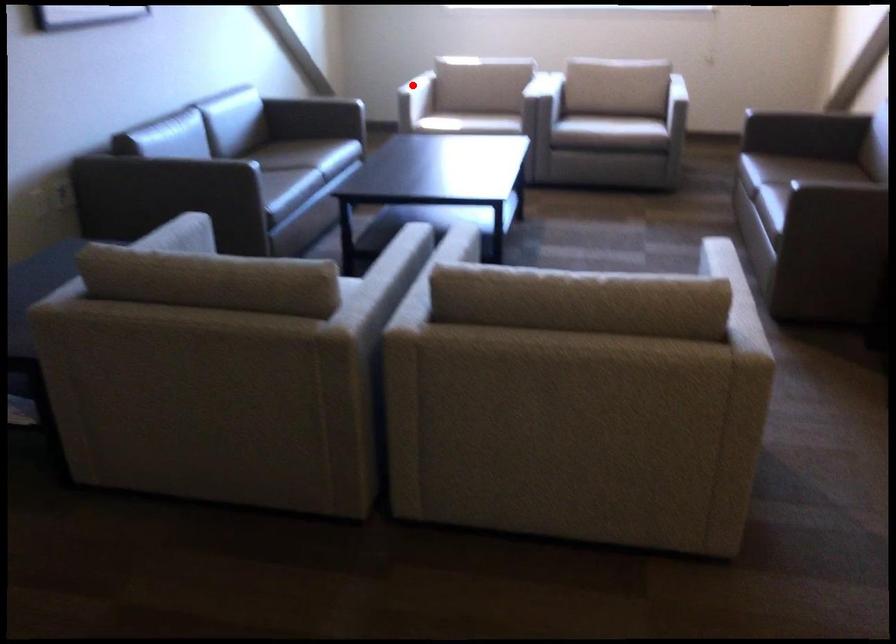
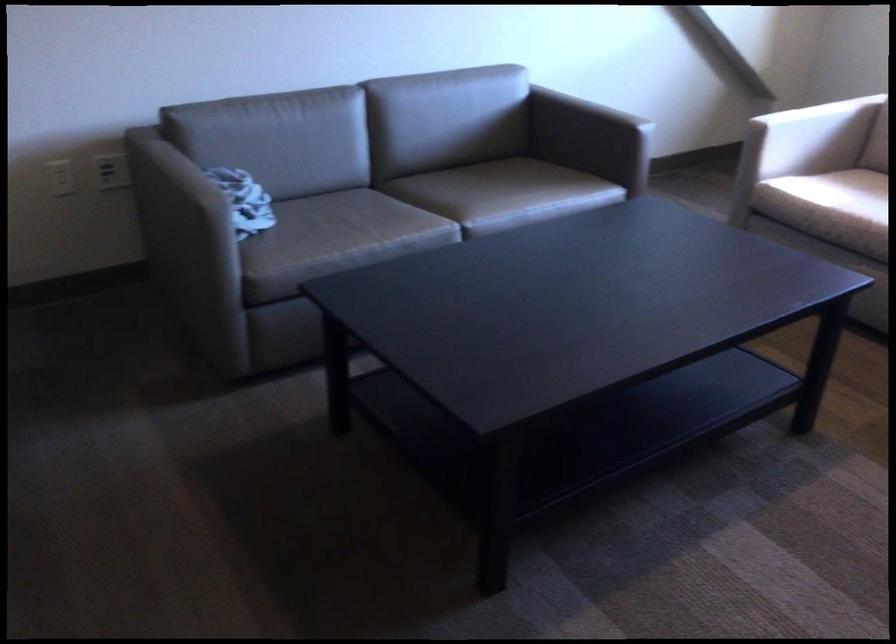
Question: I am providing you with two images of the same scene from different viewpoints. A red point is shown in image1. For the corresponding object point in image2, is it positioned nearer or farther from the camera?

Choices:
 (A) Nearer
 (B) Farther

Answer: (A)